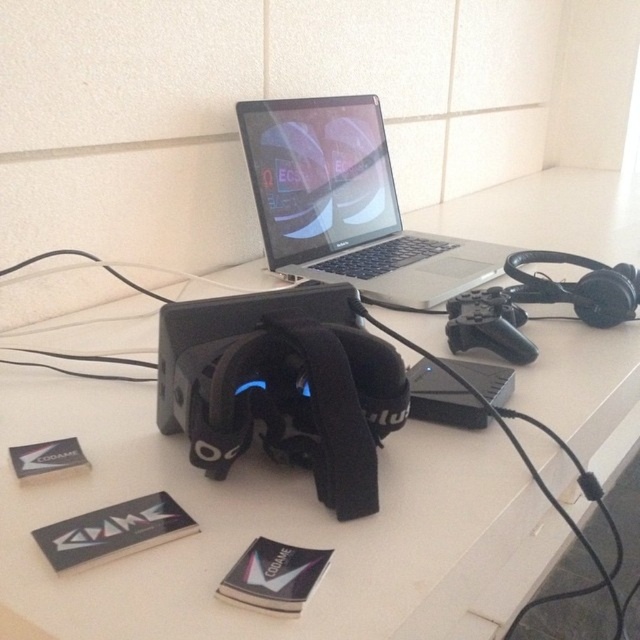
You are a delivery person holding a package that requires a flat surface to place. You see the white matte computer desk at center. Can you place the package on it?

Yes, the white matte computer desk at center is a flat surface and the distance from the camera is 14.66 inches, so you can place the package on it.

You are setting up a new monitor and need to place it on the white matte computer desk at center. However, there is a silver metallic laptop at center currently occupying space. Where should you position the monitor relative to the laptop to ensure it doesn not block the desk area?

The white matte computer desk at center is located below the silver metallic laptop at center, so placing the monitor below the laptop would keep it from blocking the desk area.

You are setting up a new monitor that requires a minimum of 10 inches of space between the desk and the laptop. Based on the current setup shown in the image, will there be enough space between the white matte computer desk at center and the silver metallic laptop at center?

The white matte computer desk at center and silver metallic laptop at center are 8.22 inches apart, which is less than the required 10 inches. Therefore, there is not enough space for the new monitor.